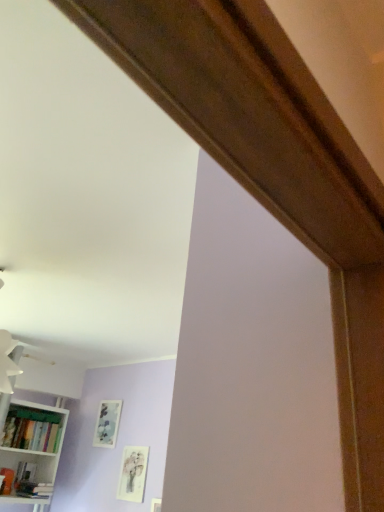
From the picture: How much space does matte silver picture frame at center, which is the second picture frame in front-to-back order, occupy vertically?

matte silver picture frame at center, which is the second picture frame in front-to-back order, is 34.16 centimeters tall.

Identify the location of white matte bookshelf at lower left. This screenshot has height=512, width=384. (36, 451).

Can you see white matte bookshelf at lower left touching matte green bookshelf at lower left?

No, white matte bookshelf at lower left is not making contact with matte green bookshelf at lower left.

Image resolution: width=384 pixels, height=512 pixels. Find the location of `bookcase below the matte green bookshelf at lower left (from the image's perspective)`. bookcase below the matte green bookshelf at lower left (from the image's perspective) is located at coordinates (36, 451).

From the image's perspective, would you say white matte bookshelf at lower left is positioned over matte green bookshelf at lower left?

No.

From a real-world perspective, does white matte bookshelf at lower left sit lower than matte green bookshelf at lower left?

Correct, in the physical world, white matte bookshelf at lower left is lower than matte green bookshelf at lower left.

From a real-world perspective, is matte green bookshelf at lower left beneath matte white picture frame at lower left, the 2th picture frame from the left?

Incorrect, from a real-world perspective, matte green bookshelf at lower left is higher than matte white picture frame at lower left, the 2th picture frame from the left.

Which is more to the right, matte green bookshelf at lower left or matte white picture frame at lower left, the 2th picture frame from the left?

Positioned to the right is matte white picture frame at lower left, the 2th picture frame from the left.

Based on their sizes in the image, would you say matte green bookshelf at lower left is bigger or smaller than matte white picture frame at lower left, which is the 1th picture frame from right to left?

Clearly, matte green bookshelf at lower left is larger in size than matte white picture frame at lower left, which is the 1th picture frame from right to left.

From the image's perspective, between matte green bookshelf at lower left and matte white picture frame at lower left, arranged as the 1th picture frame when viewed from the front, who is located below?

matte white picture frame at lower left, arranged as the 1th picture frame when viewed from the front, appears lower in the image.

Does white matte bookshelf at lower left appear on the left side of matte white picture frame at lower left, which is the 1th picture frame from right to left?

Correct, you'll find white matte bookshelf at lower left to the left of matte white picture frame at lower left, which is the 1th picture frame from right to left.

Is white matte bookshelf at lower left wider or thinner than matte white picture frame at lower left, arranged as the 1th picture frame when viewed from the front?

white matte bookshelf at lower left is wider than matte white picture frame at lower left, arranged as the 1th picture frame when viewed from the front.

Is white matte bookshelf at lower left with matte white picture frame at lower left, the 2th picture frame when ordered from back to front?

No, white matte bookshelf at lower left is not touching matte white picture frame at lower left, the 2th picture frame when ordered from back to front.

Consider the image. Is white matte bookshelf at lower left positioned with its back to matte white picture frame at lower left, arranged as the 1th picture frame when viewed from the front?

No, white matte bookshelf at lower left is not facing the opposite direction of matte white picture frame at lower left, arranged as the 1th picture frame when viewed from the front.

Measure the distance from matte green bookshelf at lower left to white matte bookshelf at lower left.

matte green bookshelf at lower left and white matte bookshelf at lower left are 6.62 inches apart.

From the image's perspective, which object appears higher, matte green bookshelf at lower left or white matte bookshelf at lower left?

matte green bookshelf at lower left, from the image's perspective.

Considering the sizes of objects matte green bookshelf at lower left and white matte bookshelf at lower left in the image provided, who is smaller, matte green bookshelf at lower left or white matte bookshelf at lower left?

With smaller size is matte green bookshelf at lower left.

Is matte green bookshelf at lower left with white matte bookshelf at lower left?

matte green bookshelf at lower left is not next to white matte bookshelf at lower left, and they're not touching.

Is matte silver picture frame at center, the 1th picture frame when ordered from left to right, spatially inside white matte bookshelf at lower left, or outside of it?

matte silver picture frame at center, the 1th picture frame when ordered from left to right, exists outside the volume of white matte bookshelf at lower left.

In the image, there is a matte silver picture frame at center, placed as the first picture frame when sorted from back to front. Find the location of `bookcase below it (from the image's perspective)`. bookcase below it (from the image's perspective) is located at coordinates (36, 451).

Can you tell me how much matte silver picture frame at center, which is the second picture frame in right-to-left order, and white matte bookshelf at lower left differ in facing direction?

matte silver picture frame at center, which is the second picture frame in right-to-left order, and white matte bookshelf at lower left are facing 90 degrees away from each other.

Is matte silver picture frame at center, the 1th picture frame when ordered from left to right, to the right of white matte bookshelf at lower left from the viewer's perspective?

Indeed, matte silver picture frame at center, the 1th picture frame when ordered from left to right, is positioned on the right side of white matte bookshelf at lower left.

Considering the relative sizes of matte silver picture frame at center, placed as the first picture frame when sorted from back to front, and matte white picture frame at lower left, the 2th picture frame when ordered from back to front, in the image provided, is matte silver picture frame at center, placed as the first picture frame when sorted from back to front, smaller than matte white picture frame at lower left, the 2th picture frame when ordered from back to front,?

Incorrect, matte silver picture frame at center, placed as the first picture frame when sorted from back to front, is not smaller in size than matte white picture frame at lower left, the 2th picture frame when ordered from back to front.

Find the location of a particular element. picture frame located on the right of matte silver picture frame at center, which is the second picture frame in front-to-back order is located at coordinates (133, 473).

Is matte silver picture frame at center, the 1th picture frame when ordered from left to right, wider or thinner than matte white picture frame at lower left, which is the 1th picture frame from right to left?

matte silver picture frame at center, the 1th picture frame when ordered from left to right, is wider than matte white picture frame at lower left, which is the 1th picture frame from right to left.

Is matte silver picture frame at center, the 1th picture frame when ordered from left to right, positioned in front of matte white picture frame at lower left, arranged as the 1th picture frame when viewed from the front?

No, matte silver picture frame at center, the 1th picture frame when ordered from left to right, is behind matte white picture frame at lower left, arranged as the 1th picture frame when viewed from the front.

Considering the relative sizes of matte silver picture frame at center, which is the second picture frame in front-to-back order, and matte green bookshelf at lower left in the image provided, is matte silver picture frame at center, which is the second picture frame in front-to-back order, smaller than matte green bookshelf at lower left?

Indeed, matte silver picture frame at center, which is the second picture frame in front-to-back order, has a smaller size compared to matte green bookshelf at lower left.

From the image's perspective, which one is positioned lower, matte silver picture frame at center, placed as the first picture frame when sorted from back to front, or matte green bookshelf at lower left?

matte green bookshelf at lower left appears lower in the image.

Is matte silver picture frame at center, which is the second picture frame in right-to-left order, facing towards matte green bookshelf at lower left?

No.

You are a GUI agent. You are given a task and a screenshot of the screen. Output one action in this format:
    pyautogui.click(x=<x>, y=<y>)
    Task: Click on the book above the white matte bookshelf at lower left (from a real-world perspective)
    The image size is (384, 512).
    Given the screenshot: What is the action you would take?
    coord(32,429)

Identify the location of book that appears on the left of matte white picture frame at lower left, which is the 1th picture frame from right to left. coord(32,429).

Which object lies nearer to the anchor point white matte bookshelf at lower left, matte green bookshelf at lower left or matte silver picture frame at center, which is the second picture frame in right-to-left order?

The object closer to white matte bookshelf at lower left is matte green bookshelf at lower left.

Estimate the real-world distances between objects in this image. Which object is further from white matte bookshelf at lower left, matte white picture frame at lower left, the 2th picture frame from the left, or matte green bookshelf at lower left?

matte white picture frame at lower left, the 2th picture frame from the left, lies further to white matte bookshelf at lower left than the other object.

Estimate the real-world distances between objects in this image. Which object is closer to white matte bookshelf at lower left, matte silver picture frame at center, the 1th picture frame when ordered from left to right, or matte white picture frame at lower left, arranged as the 1th picture frame when viewed from the front?

matte silver picture frame at center, the 1th picture frame when ordered from left to right.

Based on their spatial positions, is white matte bookshelf at lower left or matte silver picture frame at center, which is the second picture frame in right-to-left order, closer to matte white picture frame at lower left, which is the 1th picture frame from right to left?

matte silver picture frame at center, which is the second picture frame in right-to-left order, is positioned closer to the anchor matte white picture frame at lower left, which is the 1th picture frame from right to left.

Based on their spatial positions, is matte silver picture frame at center, placed as the first picture frame when sorted from back to front, or white matte bookshelf at lower left closer to matte green bookshelf at lower left?

white matte bookshelf at lower left is positioned closer to the anchor matte green bookshelf at lower left.

Based on their spatial positions, is matte white picture frame at lower left, the 2th picture frame from the left, or white matte bookshelf at lower left closer to matte silver picture frame at center, placed as the first picture frame when sorted from back to front?

matte white picture frame at lower left, the 2th picture frame from the left.

Which object lies further to the anchor point matte green bookshelf at lower left, white matte bookshelf at lower left or matte silver picture frame at center, the 1th picture frame when ordered from left to right?

The object further to matte green bookshelf at lower left is matte silver picture frame at center, the 1th picture frame when ordered from left to right.

Looking at this image, when comparing their distances from white matte bookshelf at lower left, does matte white picture frame at lower left, which is the 1th picture frame from right to left, or matte silver picture frame at center, the 1th picture frame when ordered from left to right, seem further?

Based on the image, matte white picture frame at lower left, which is the 1th picture frame from right to left, appears to be further to white matte bookshelf at lower left.

The image size is (384, 512). Find the location of `book between white matte bookshelf at lower left and matte white picture frame at lower left, the 2th picture frame from the left`. book between white matte bookshelf at lower left and matte white picture frame at lower left, the 2th picture frame from the left is located at coordinates (32, 429).

At what (x,y) coordinates should I click in order to perform the action: click on picture frame between matte green bookshelf at lower left and matte white picture frame at lower left, which is the 1th picture frame from right to left, in the horizontal direction. Please return your answer as a coordinate pair (x, y). This screenshot has width=384, height=512. Looking at the image, I should click on (107, 423).

I want to click on picture frame situated between white matte bookshelf at lower left and matte white picture frame at lower left, the 2th picture frame from the left, from left to right, so click(107, 423).

Locate an element on the screen. This screenshot has width=384, height=512. book between white matte bookshelf at lower left and matte silver picture frame at center, the 1th picture frame when ordered from left to right is located at coordinates (32, 429).